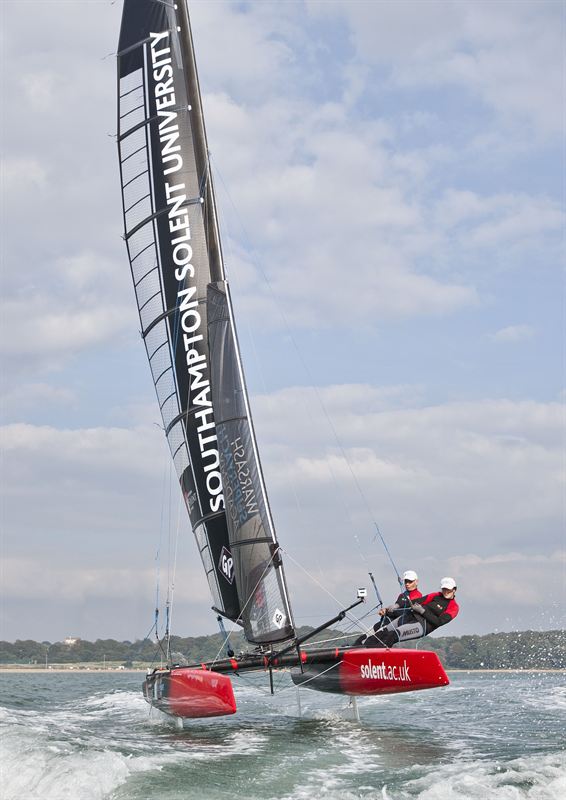
At what (x,y) coordinates should I click in order to perform the action: click on cables. Please return your answer as a coordinate pair (x, y). This screenshot has width=566, height=800. Looking at the image, I should click on (161, 574), (168, 578), (367, 566), (385, 548), (324, 588), (244, 606), (307, 678).